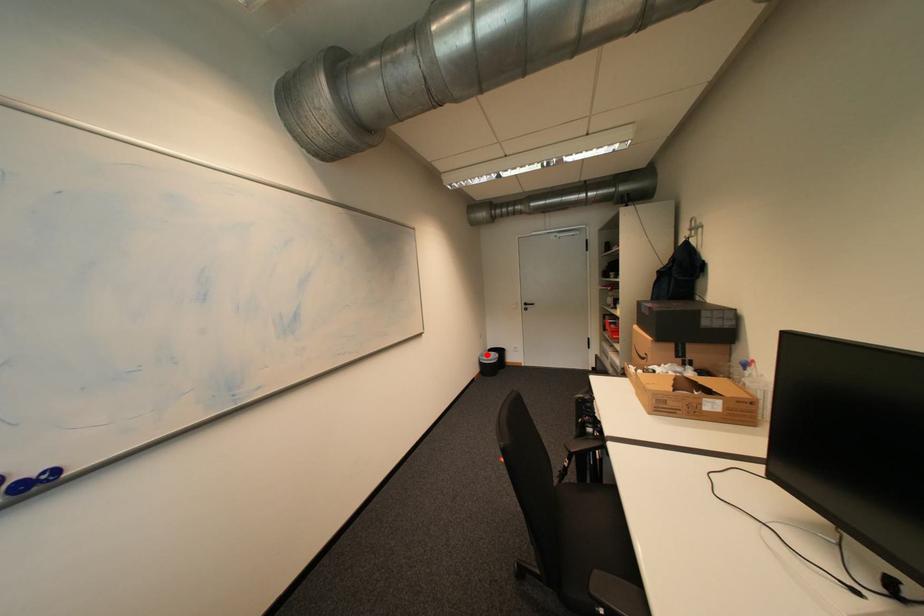
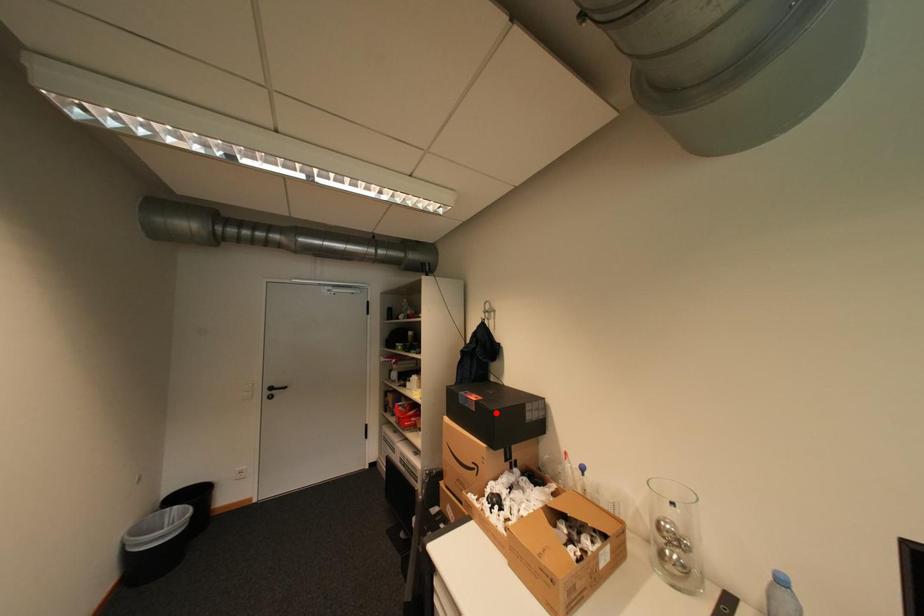
I am providing you with two images of the same scene from different viewpoints. A red point is marked on the first image and another point is marked on the second image. Is the marked point in image1 the same physical position as the marked point in image2?

No